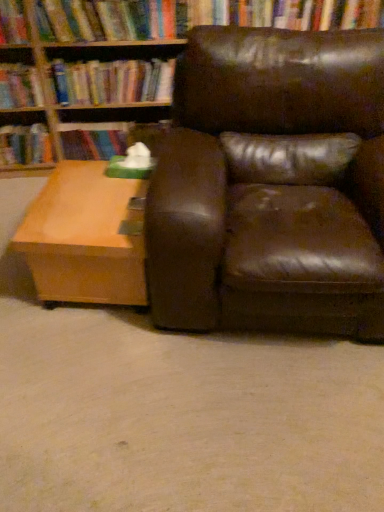
Where is `blank space above hardcover book at left, which ranks as the 1th book in left-to-right order (from a real-world perspective)`? blank space above hardcover book at left, which ranks as the 1th book in left-to-right order (from a real-world perspective) is located at coordinates (22, 125).